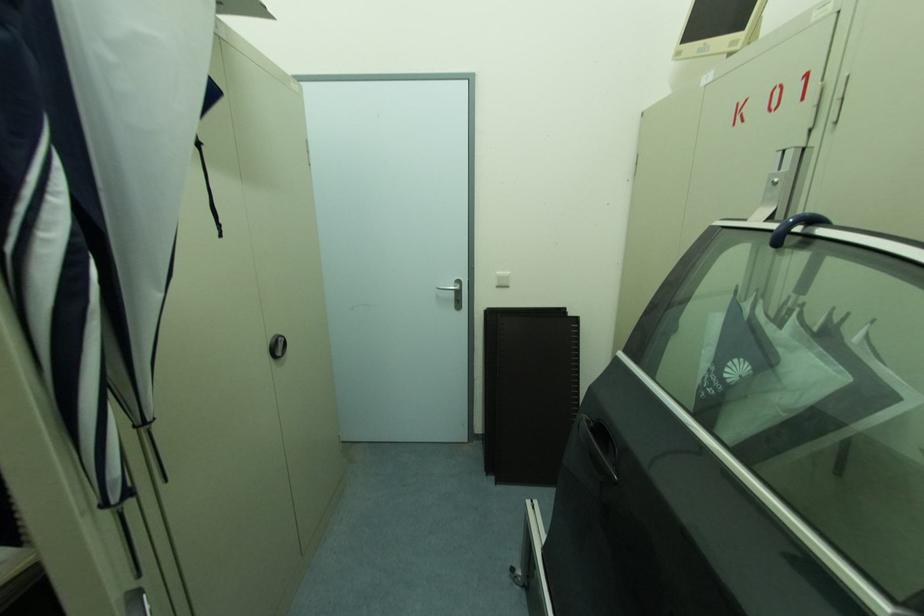
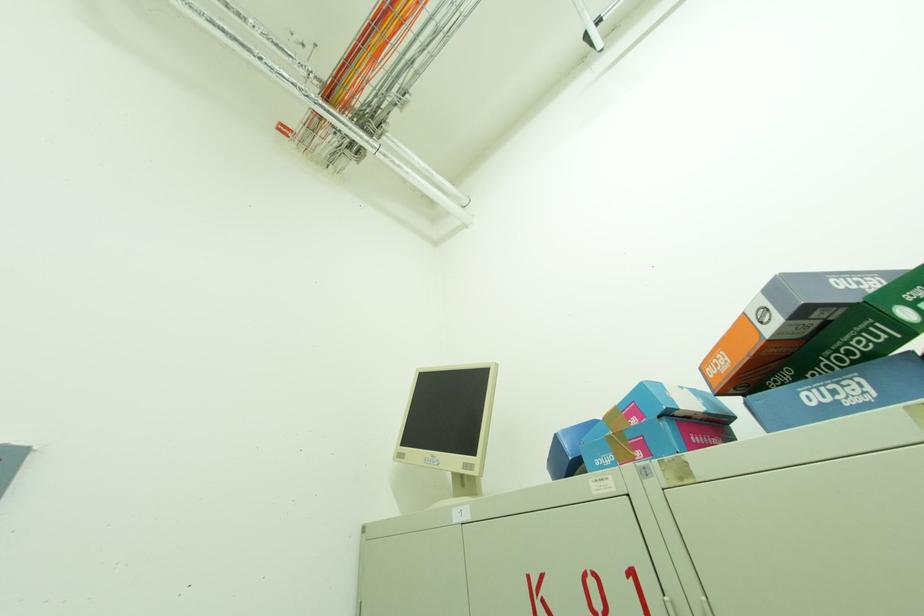
Consider the image. Based on the continuous images, in which direction is the camera rotating?

The rotation direction of the camera is right-up.